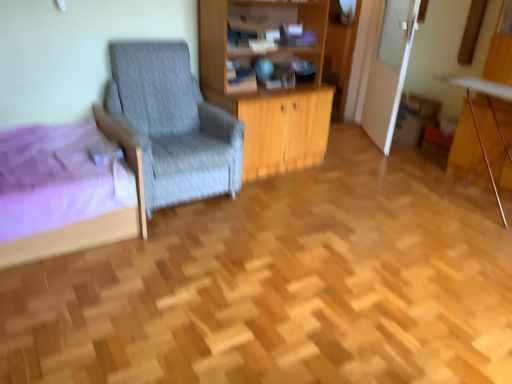
Measure the distance between point (x=118, y=217) and camera.

Point (x=118, y=217) is 7.83 feet away from camera.

Based on the photo, measure the distance between gray fabric chair at left and camera.

gray fabric chair at left and camera are 7.62 feet apart from each other.

Where is `wooden cabinet at center`? This screenshot has width=512, height=384. wooden cabinet at center is located at coordinates (264, 86).

Is purple fabric bed at lower left thinner than wooden cabinet at center?

Incorrect, the width of purple fabric bed at lower left is not less than that of wooden cabinet at center.

How distant is purple fabric bed at lower left from wooden cabinet at center?

purple fabric bed at lower left is 4.25 feet away from wooden cabinet at center.

From a real-world perspective, who is located higher, purple fabric bed at lower left or wooden cabinet at center?

A: From a 3D spatial view, wooden cabinet at center is above.

Where is `bed on the left of wooden cabinet at center`? This screenshot has width=512, height=384. bed on the left of wooden cabinet at center is located at coordinates (91, 218).

From a real-world perspective, which is physically below, wooden cabinet at center or purple fabric bed at lower left?

In real-world perspective, purple fabric bed at lower left is lower.

Is wooden cabinet at center smaller than purple fabric bed at lower left?

No, wooden cabinet at center is not smaller than purple fabric bed at lower left.

Relative to purple fabric bed at lower left, is wooden cabinet at center in front or behind?

In the image, wooden cabinet at center appears behind purple fabric bed at lower left.

Which object is positioned more to the right, wooden cabinet at center or purple fabric bed at lower left?

Positioned to the right is wooden cabinet at center.

Consider the image. Can you confirm if wooden desk at right is bigger than gray fabric chair at left?

Actually, wooden desk at right might be smaller than gray fabric chair at left.

You are a GUI agent. You are given a task and a screenshot of the screen. Output one action in this format:
    pyautogui.click(x=<x>, y=<y>)
    Task: Click on the computer desk that appears behind the gray fabric chair at left
    Image resolution: width=512 pixels, height=384 pixels.
    Given the screenshot: What is the action you would take?
    pyautogui.click(x=492, y=113)

From a real-world perspective, who is located higher, wooden desk at right or gray fabric chair at left?

gray fabric chair at left, from a real-world perspective.

Which object is wider, wooden desk at right or gray fabric chair at left?

gray fabric chair at left is wider.

How different are the orientations of purple fabric bed at lower left and gray fabric chair at left in degrees?

purple fabric bed at lower left and gray fabric chair at left are facing 89.9 degrees away from each other.

Considering the relative sizes of purple fabric bed at lower left and gray fabric chair at left in the image provided, is purple fabric bed at lower left smaller than gray fabric chair at left?

Yes, purple fabric bed at lower left is smaller than gray fabric chair at left.

Is purple fabric bed at lower left with gray fabric chair at left?

No, purple fabric bed at lower left is not in contact with gray fabric chair at left.

Identify the location of bed below the gray fabric chair at left (from a real-world perspective). The width and height of the screenshot is (512, 384). click(91, 218).

From the image's perspective, is gray fabric chair at left located beneath wooden desk at right?

No, from the image's perspective, gray fabric chair at left is not below wooden desk at right.

Which object is further away from the camera taking this photo, gray fabric chair at left or wooden desk at right?

Positioned behind is wooden desk at right.

Considering the sizes of gray fabric chair at left and wooden desk at right in the image, is gray fabric chair at left taller or shorter than wooden desk at right?

Clearly, gray fabric chair at left is taller compared to wooden desk at right.

Is gray fabric chair at left with wooden desk at right?

No, gray fabric chair at left is not with wooden desk at right.

Is point (220, 127) more distant than point (55, 244)?

Yes, it is.

From the image's perspective, does gray fabric chair at left appear higher than purple fabric bed at lower left?

Correct, gray fabric chair at left appears higher than purple fabric bed at lower left in the image.

Is gray fabric chair at left oriented towards purple fabric bed at lower left?

No, gray fabric chair at left is not aimed at purple fabric bed at lower left.

Consider the image. From a real-world perspective, is gray fabric chair at left under purple fabric bed at lower left?

No, from a real-world perspective, gray fabric chair at left is not under purple fabric bed at lower left.

From the image's perspective, between wooden cabinet at center and gray fabric chair at left, who is located below?

gray fabric chair at left, from the image's perspective.

From a real-world perspective, which object rests below the other?

From a 3D spatial view, gray fabric chair at left is below.

Which object is thinner, wooden cabinet at center or gray fabric chair at left?

Thinner between the two is wooden cabinet at center.

Is wooden cabinet at center placed right next to gray fabric chair at left?

No, wooden cabinet at center is not next to gray fabric chair at left.

Where is `dresser above the purple fabric bed at lower left (from the image's perspective)`? Image resolution: width=512 pixels, height=384 pixels. dresser above the purple fabric bed at lower left (from the image's perspective) is located at coordinates (264, 86).

At what (x,y) coordinates should I click in order to perform the action: click on bed in front of the wooden cabinet at center. Please return your answer as a coordinate pair (x, y). This screenshot has width=512, height=384. Looking at the image, I should click on (91, 218).

Based on their spatial positions, is wooden cabinet at center or gray fabric chair at left further from wooden desk at right?

gray fabric chair at left.

Estimate the real-world distances between objects in this image. Which object is closer to wooden desk at right, gray fabric chair at left or purple fabric bed at lower left?

gray fabric chair at left lies closer to wooden desk at right than the other object.

Which object lies nearer to the anchor point purple fabric bed at lower left, wooden desk at right or wooden cabinet at center?

wooden cabinet at center lies closer to purple fabric bed at lower left than the other object.

Looking at this image, when comparing their distances from wooden desk at right, does gray fabric chair at left or wooden cabinet at center seem further?

gray fabric chair at left.

Considering their positions, is wooden cabinet at center positioned closer to wooden desk at right than purple fabric bed at lower left?

wooden cabinet at center lies closer to wooden desk at right than the other object.

Estimate the real-world distances between objects in this image. Which object is closer to purple fabric bed at lower left, wooden cabinet at center or gray fabric chair at left?

gray fabric chair at left.

From the image, which object appears to be nearer to gray fabric chair at left, wooden cabinet at center or purple fabric bed at lower left?

Based on the image, wooden cabinet at center appears to be nearer to gray fabric chair at left.

When comparing their distances from purple fabric bed at lower left, does gray fabric chair at left or wooden desk at right seem further?

Among the two, wooden desk at right is located further to purple fabric bed at lower left.

Identify the location of dresser between purple fabric bed at lower left and wooden desk at right from left to right. This screenshot has width=512, height=384. (264, 86).

At what (x,y) coordinates should I click in order to perform the action: click on dresser located between gray fabric chair at left and wooden desk at right in the left-right direction. Please return your answer as a coordinate pair (x, y). The width and height of the screenshot is (512, 384). Looking at the image, I should click on (264, 86).

Locate an element on the screen. Image resolution: width=512 pixels, height=384 pixels. chair located between purple fabric bed at lower left and wooden cabinet at center in the left-right direction is located at coordinates (173, 124).

Identify the location of chair between purple fabric bed at lower left and wooden desk at right from left to right. (173, 124).